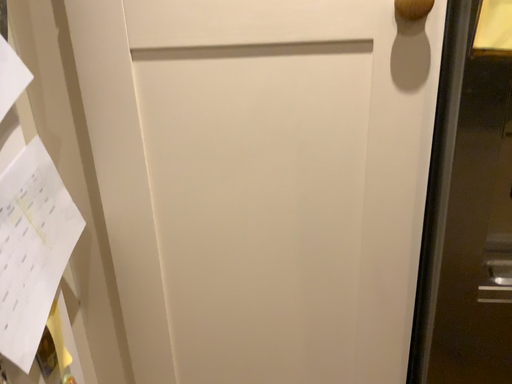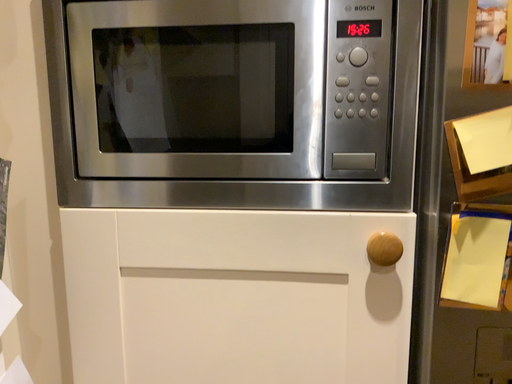
Question: Which way did the camera rotate in the video?

Choices:
 (A) rotated downward
 (B) rotated upward

Answer: (B)